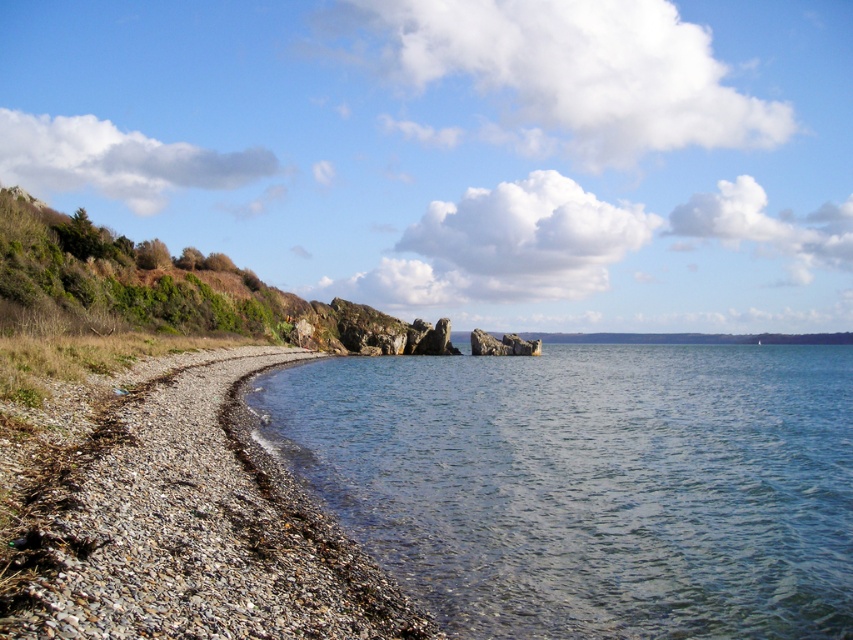
Is clear water at lower left to the left of smooth pebbles at lower left from the viewer's perspective?

In fact, clear water at lower left is to the right of smooth pebbles at lower left.

Is clear water at lower left smaller than smooth pebbles at lower left?

No, clear water at lower left is not smaller than smooth pebbles at lower left.

Between point (397, 467) and point (48, 449), which one is positioned in front?

Point (48, 449)

Image resolution: width=853 pixels, height=640 pixels. I want to click on clear water at lower left, so click(x=589, y=484).